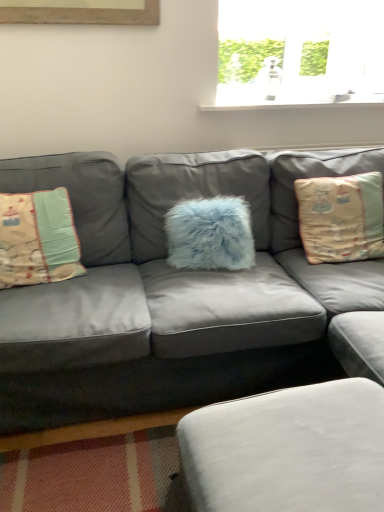
Locate an element on the screen. The image size is (384, 512). vacant space situated above white fabric footrest at lower center (from a real-world perspective) is located at coordinates (305, 437).